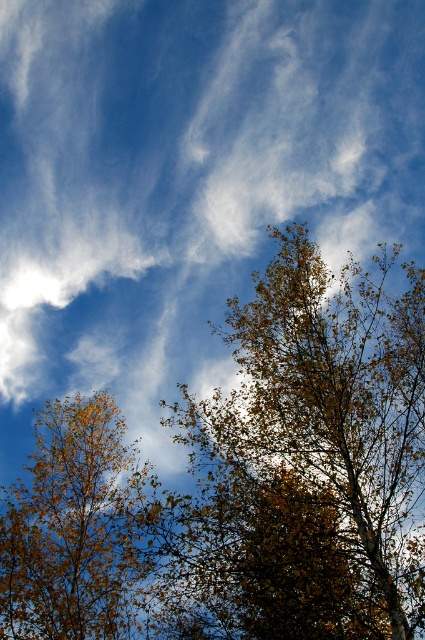
You are a photographer standing in the middle of the scene. You want to take a photo that includes both the point at (306, 273) and the point at (34, 614). Which point should you focus on first to ensure both are in focus?

You should focus on the point at (306, 273) first because it is closer to the camera than the point at (34, 614). By focusing on the closer point, the farther point will also be within the depth of field and in focus.